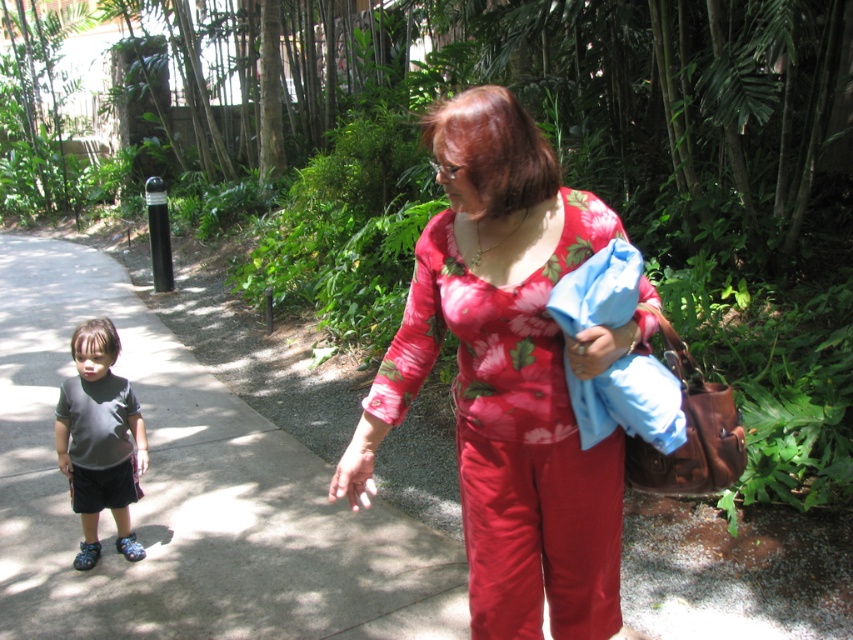
Based on the photo, you are a pedestrian walking on the gray concrete pavement at lower left and want to reach the floral cotton blouse at center. Which direction should you move to get there?

To reach the floral cotton blouse at center from the gray concrete pavement at lower left, you should move to the right since the gray concrete pavement at lower left is positioned to the left of the floral cotton blouse at center.

You are a pedestrian walking on the gray concrete pavement at lower left and see the dark gray matte shirt at left. Which object is closer to the ground?

The gray concrete pavement at lower left is positioned under dark gray matte shirt at left, so the gray concrete pavement at lower left is closer to the ground.

You are standing at the point marked as point (567, 422) in the image. The adult wearing a vibrant red floral top and matching red pants is walking towards you. The child in gray T shirt and dark shorts is standing still behind the adult. Can you estimate how far the adult wearing a vibrant red floral top and matching red pants is from you?

The distance between point (567, 422) and the viewer is 6.76 feet. Since the adult is at that point, the adult wearing a vibrant red floral top and matching red pants is approximately 6.76 feet away from you.